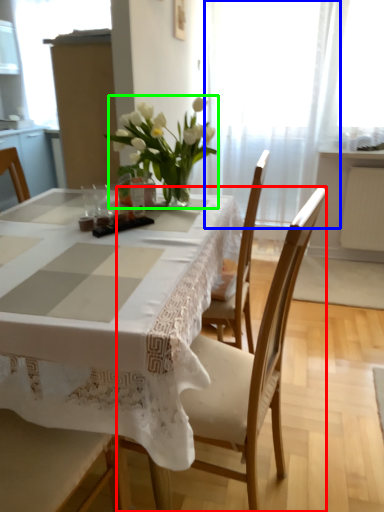
Question: Which object is positioned farthest from chair (highlighted by a red box)? Select from curtain (highlighted by a blue box) and houseplant (highlighted by a green box).

Choices:
 (A) curtain
 (B) houseplant

Answer: (A)